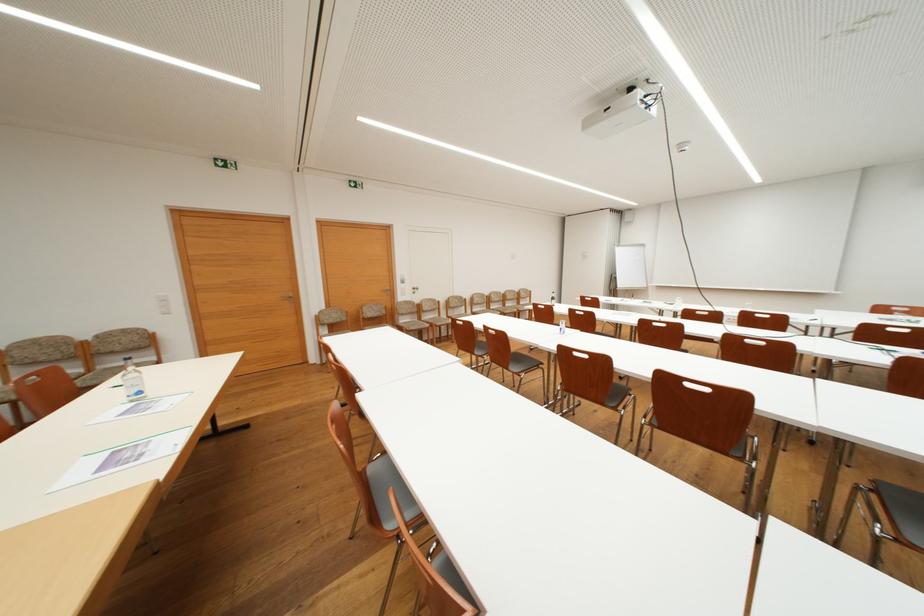
Find the location of `wall light switch`. wall light switch is located at coordinates (163, 302).